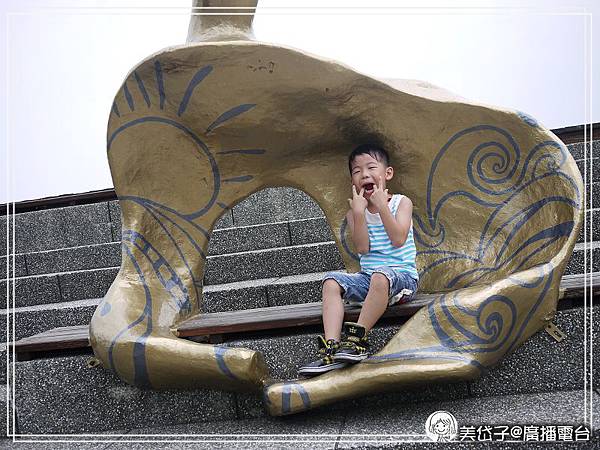
The image size is (600, 450). Find the location of `sculpture`. sculpture is located at coordinates (292, 101).